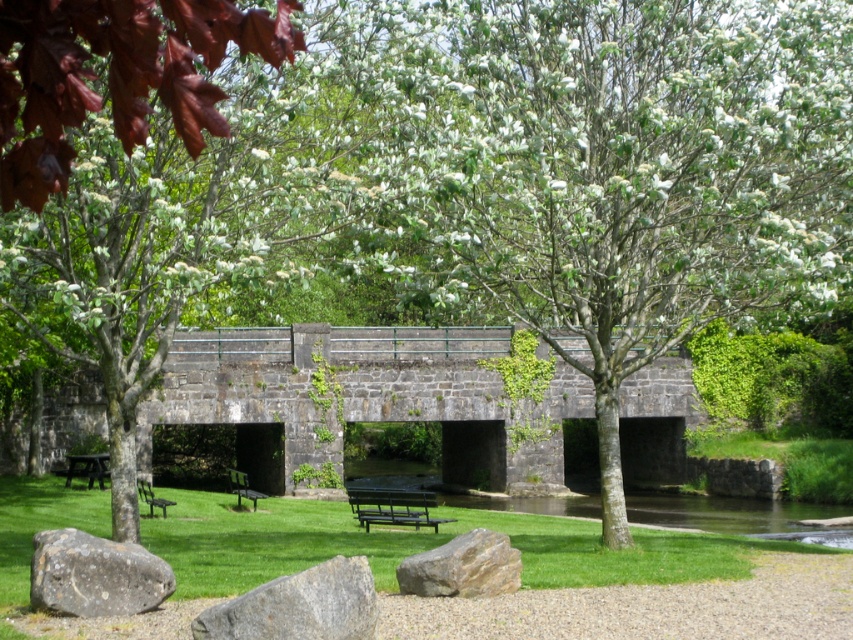
How distant is stone bridge at center from wooden park bench at center?

stone bridge at center is 7.81 meters away from wooden park bench at center.

Measure the distance from stone bridge at center to wooden park bench at center.

7.81 meters

Does point (398, 353) lie in front of point (239, 474)?

That is False.

The image size is (853, 640). In order to click on stone bridge at center in this screenshot , I will do `click(363, 397)`.

Who is shorter, black wood bench at center or green painted wood bench at lower left?

green painted wood bench at lower left is shorter.

Who is more distant from viewer, (364,500) or (149,508)?

The point (149,508) is behind.

The height and width of the screenshot is (640, 853). Find the location of `black wood bench at center`. black wood bench at center is located at coordinates (393, 506).

Which is more to the left, gray rough rock at lower center or green painted wood bench at lower left?

From the viewer's perspective, green painted wood bench at lower left appears more on the left side.

Is gray rough rock at lower center closer to camera compared to green painted wood bench at lower left?

That is True.

Identify the location of gray rough rock at lower center. (299, 605).

Where is `gray rough rock at lower center`? gray rough rock at lower center is located at coordinates (299, 605).